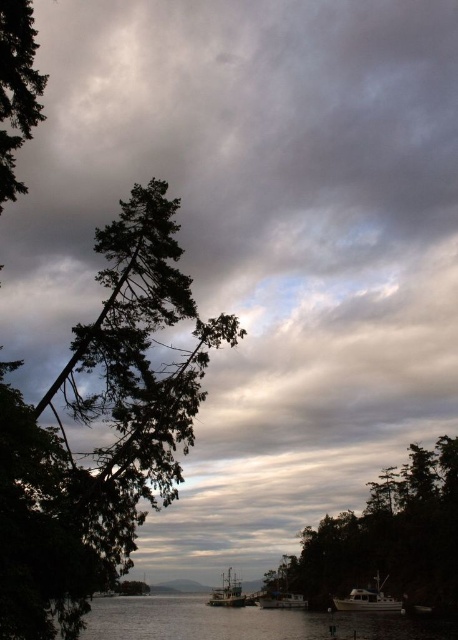
You are standing at the lakeside and notice a green matte tree at center and a white matte boat at center. Which object is closer to you?

The green matte tree at center is closer to you because it is in front of the white matte boat at center.

You are standing at the lakeside and want to walk to the point marked as point (93, 356). However, there is an obstacle at point (247, 636). Which point is closer to you so you can decide your path?

Point (93, 356) is closer to the viewer than point (247, 636), so you should head towards point (93, 356) first to avoid the obstacle at point (247, 636).

You are an artist trying to sketch this lakeside scene. You want to ensure the dark green textured tree at left and the transparent water at lower center are proportionally accurate. Which object should you draw taller in your sketch?

The transparent water at lower center is taller than the dark green textured tree at left, so you should draw the transparent water at lower center taller in your sketch.